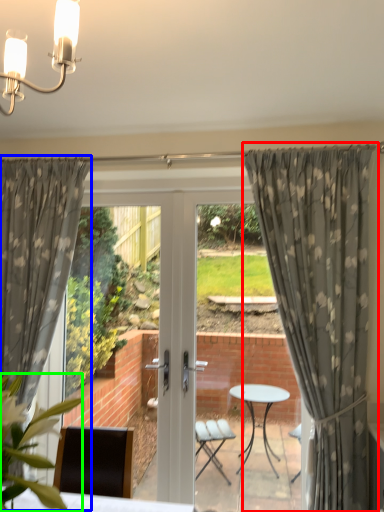
Question: Estimate the real-world distances between objects in this image. Which object is closer to curtain (highlighted by a red box), curtain (highlighted by a blue box) or plant (highlighted by a green box)?

Choices:
 (A) curtain
 (B) plant

Answer: (A)